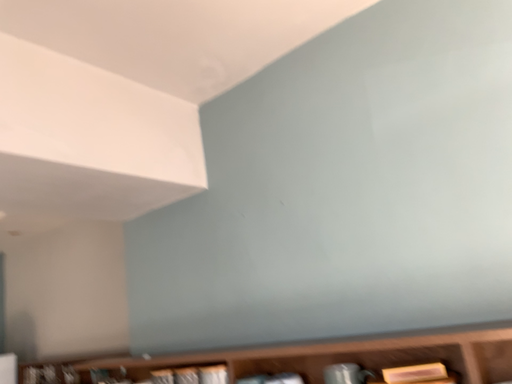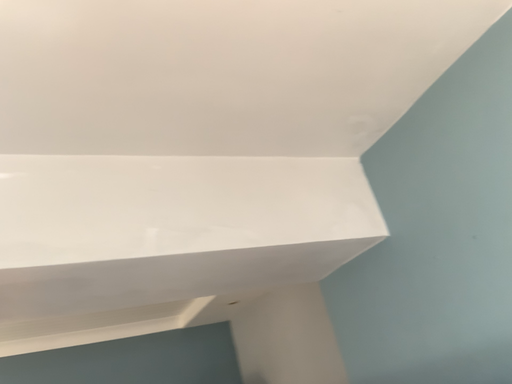
Question: How did the camera likely rotate when shooting the video?

Choices:
 (A) rotated left
 (B) rotated right

Answer: (A)